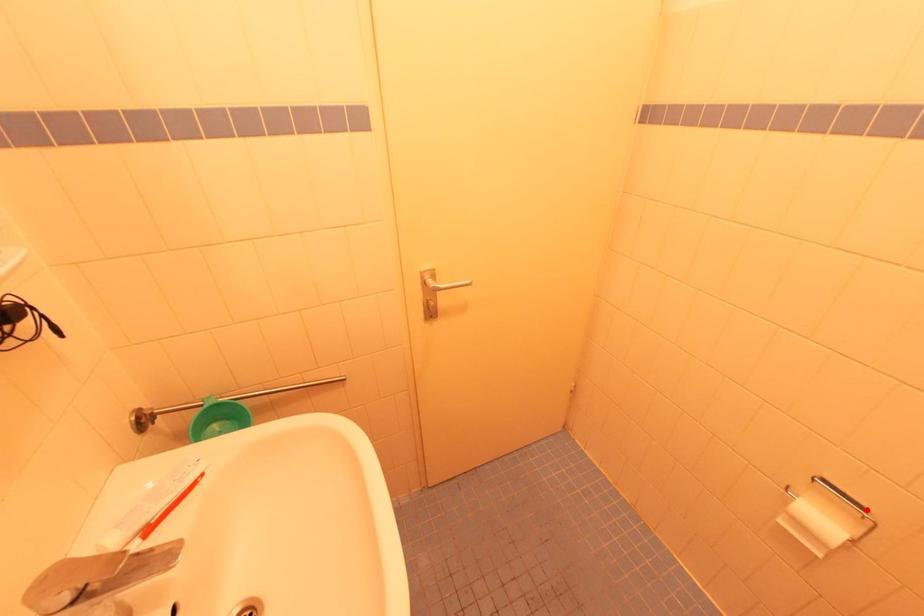
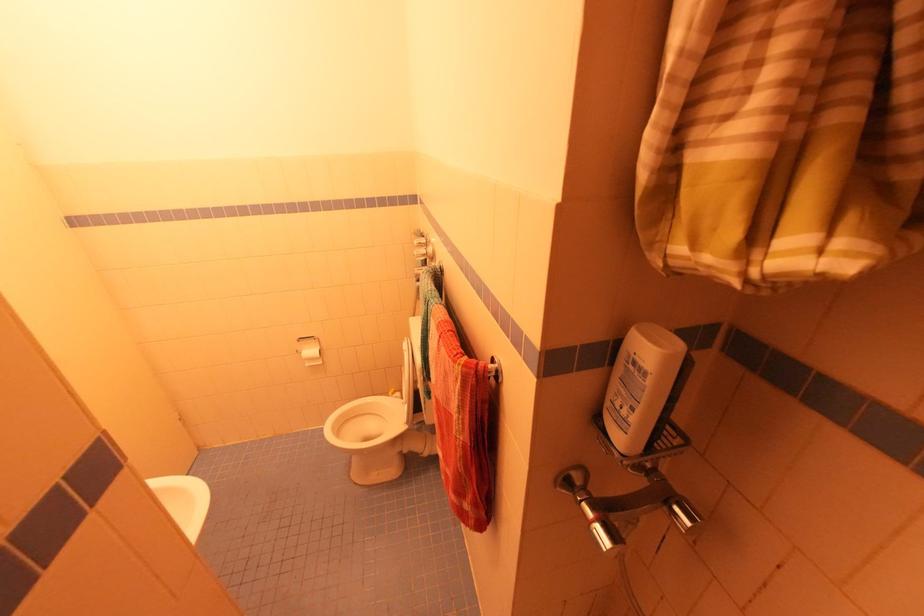
Question: I am providing you with two images of the same scene from different viewpoints. A red point is marked on the first image. At the location where the point appears in image 1, is it still visible in image 2?

Choices:
 (A) Yes
 (B) No

Answer: (A)